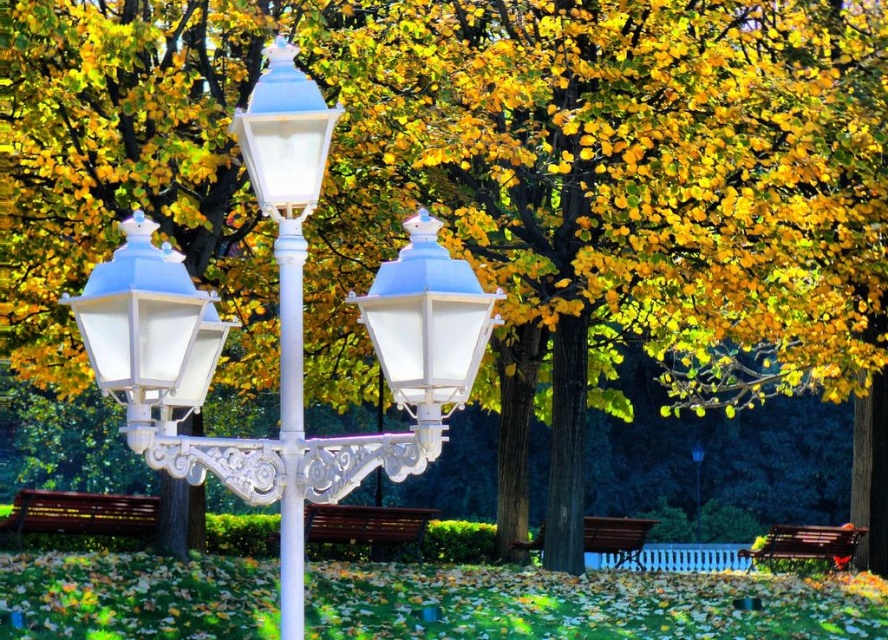
What are the coordinates of the wooden park bench at lower left?

The wooden park bench at lower left is located at coordinates point (78, 515).

You are a park visitor who wants to take a photo of the white glossy streetlight at center and the matte white lantern at center. Which object should you focus on if you want to capture the larger one in your photo?

The white glossy streetlight at center is bigger than the matte white lantern at center, so you should focus on the white glossy streetlight at center to capture the larger one in your photo.

You are a park visitor who wants to sit on the wooden park bench at lower left but notices another wooden bench at lower right. Which bench is closer to you?

The wooden park bench at lower left is closer to you because it is positioned over the wooden bench at lower right, indicating it is in front and nearer to your viewpoint.